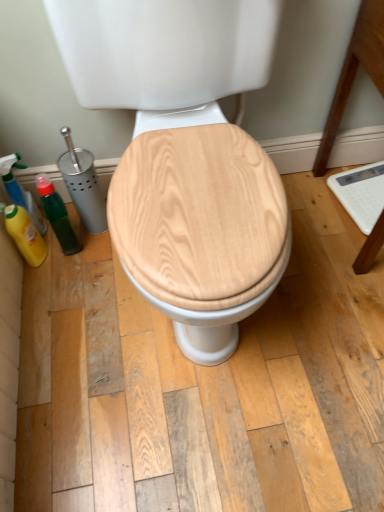
At what (x,y) coordinates should I click in order to perform the action: click on free spot in front of yellow matte bottle at left, the 1th cleaning product positioned from the bottom. Please return your answer as a coordinate pair (x, y). The height and width of the screenshot is (512, 384). Looking at the image, I should click on (58, 301).